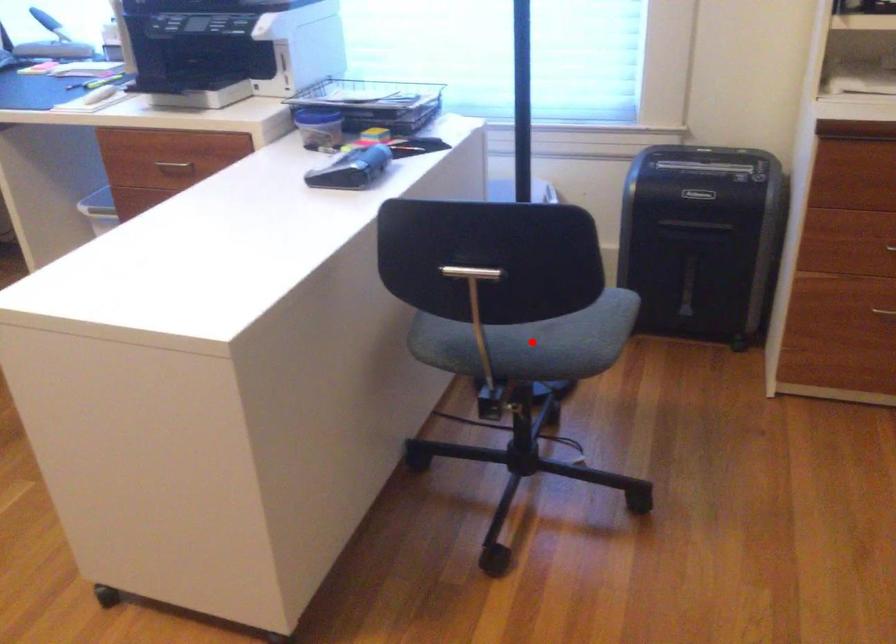
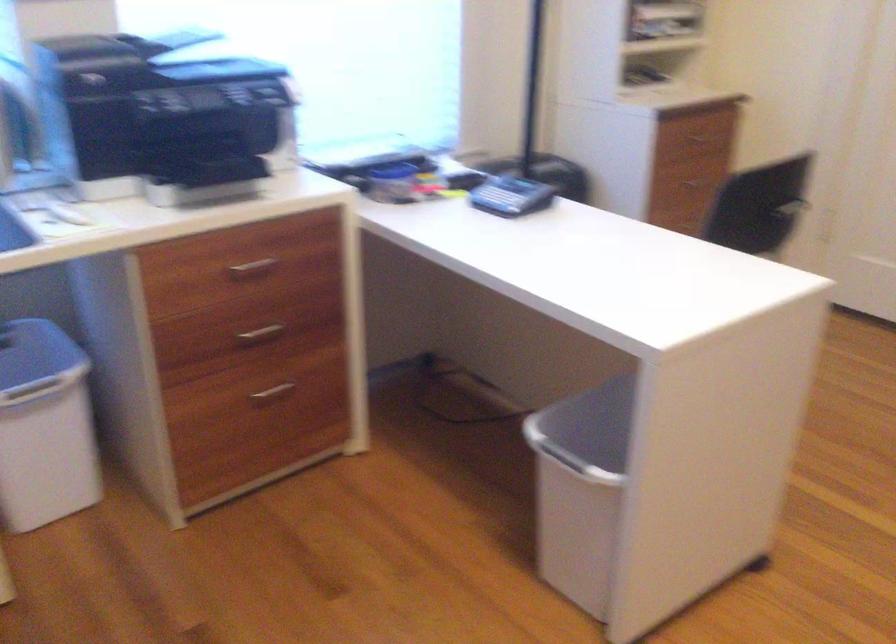
Question: I am providing you with two images of the same scene from different viewpoints. A red point is marked on the first image. At the location where the point appears in image 1, is it still visible in image 2?

Choices:
 (A) Yes
 (B) No

Answer: (B)